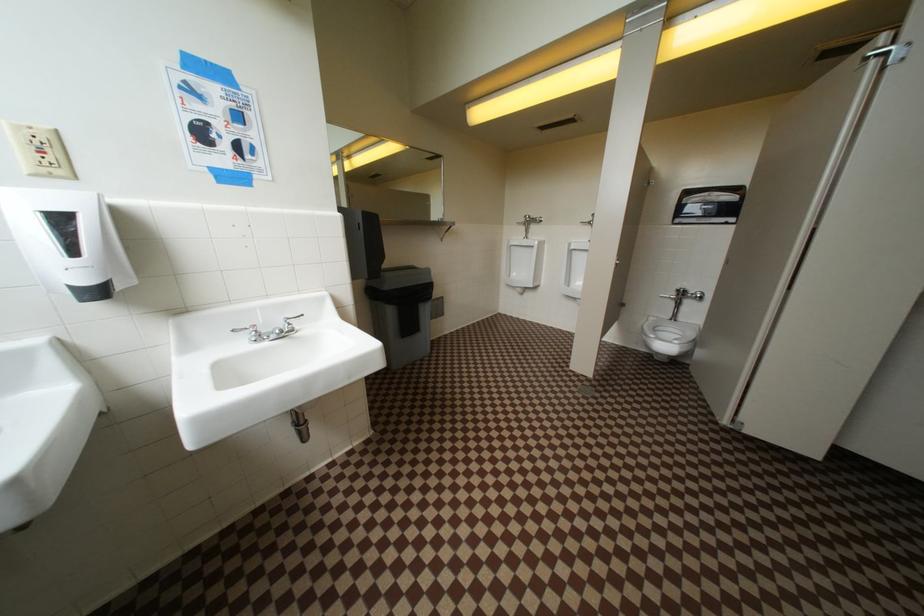
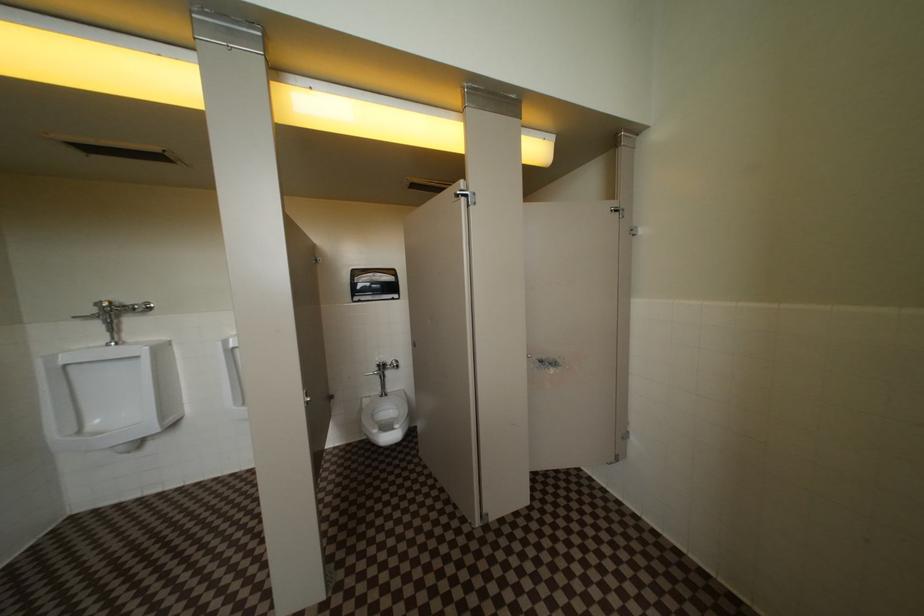
Question: How did the camera likely rotate?

Choices:
 (A) Left
 (B) Right
 (C) Up
 (D) Down

Answer: (B)